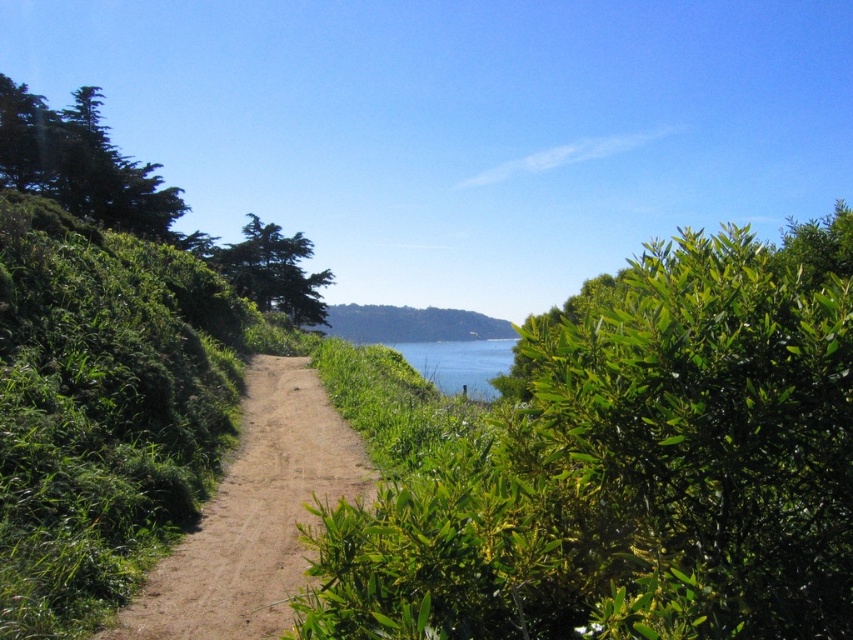
You are standing at the start of the coastal path and see the point marked at coordinates (616, 464). What is located at that point?

The point at coordinates (616, 464) corresponds to a green leafy bush at center.

You are standing on the coastal path and want to take a photo of both the green leafy bush at center and the blue water at center. Which object should you adjust your camera angle to look up towards?

You should adjust your camera angle to look up towards the green leafy bush at center because it is above the blue water at center.